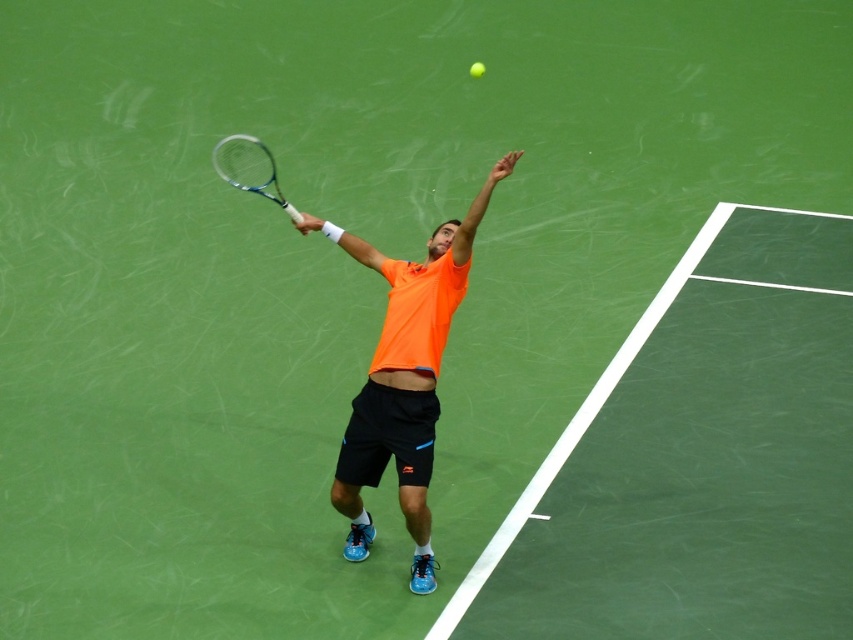
Question: Does orange fabric shirt at center appear over green matte tennis ball at upper center?

Choices:
 (A) yes
 (B) no

Answer: (B)

Question: Can you confirm if orange fabric shirt at center is positioned to the right of green matte tennis ball at upper center?

Choices:
 (A) no
 (B) yes

Answer: (A)

Question: Which of these objects is positioned farthest from the orange fabric shirt at center?

Choices:
 (A) green matte tennis ball at upper center
 (B) silver metallic tennis racket at upper center

Answer: (A)

Question: Can you confirm if orange fabric shirt at center is wider than silver metallic tennis racket at upper center?

Choices:
 (A) yes
 (B) no

Answer: (A)

Question: Which object is farther from the camera taking this photo?

Choices:
 (A) orange fabric shirt at center
 (B) silver metallic tennis racket at upper center

Answer: (B)

Question: Estimate the real-world distances between objects in this image. Which object is farther from the silver metallic tennis racket at upper center?

Choices:
 (A) orange fabric shirt at center
 (B) green matte tennis ball at upper center

Answer: (B)